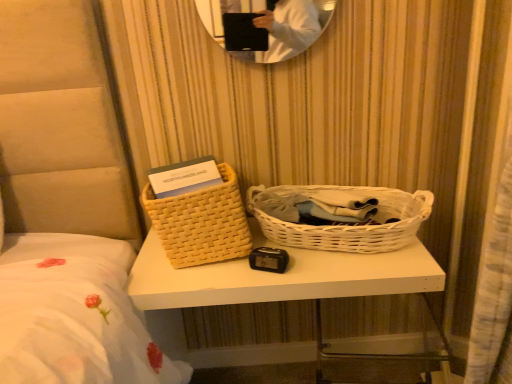
Question: From the image's perspective, is woven beige basket at left, which appears as the 1th picnic basket when viewed from the left, above or below white woven basket at center?

Choices:
 (A) below
 (B) above

Answer: (B)

Question: In the image, is woven beige basket at left, which appears as the 1th picnic basket when viewed from the left, positioned in front of or behind white woven basket at center?

Choices:
 (A) front
 (B) behind

Answer: (B)

Question: Which object is the farthest from the white wicker picnic basket at center, which is counted as the 1th picnic basket, starting from the right?

Choices:
 (A) white woven basket at center
 (B) woven beige basket at left, which appears as the 1th picnic basket when viewed from the left

Answer: (B)

Question: Estimate the real-world distances between objects in this image. Which object is farther from the white wicker picnic basket at center, placed as the second picnic basket when sorted from left to right?

Choices:
 (A) white woven basket at center
 (B) woven beige basket at left, which appears as the 1th picnic basket when viewed from the left

Answer: (B)